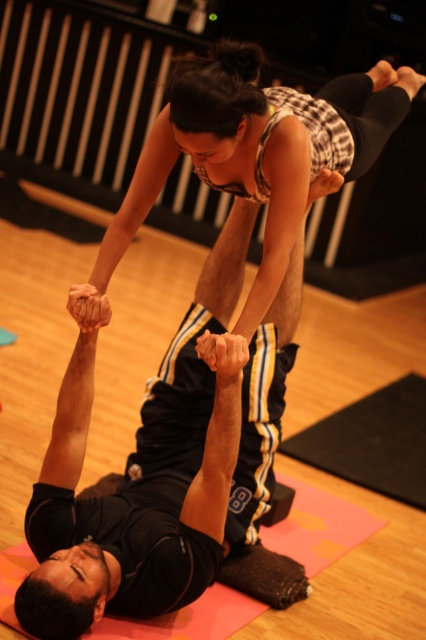
Does black matte yoga mat at upper center have a lesser height compared to matte black tank top at upper center?

No.

Which is in front, point (94, 579) or point (150, 141)?

Positioned in front is point (94, 579).

The width and height of the screenshot is (426, 640). I want to click on black matte yoga mat at upper center, so click(152, 481).

The image size is (426, 640). Find the location of `black matte yoga mat at upper center`. black matte yoga mat at upper center is located at coordinates (152, 481).